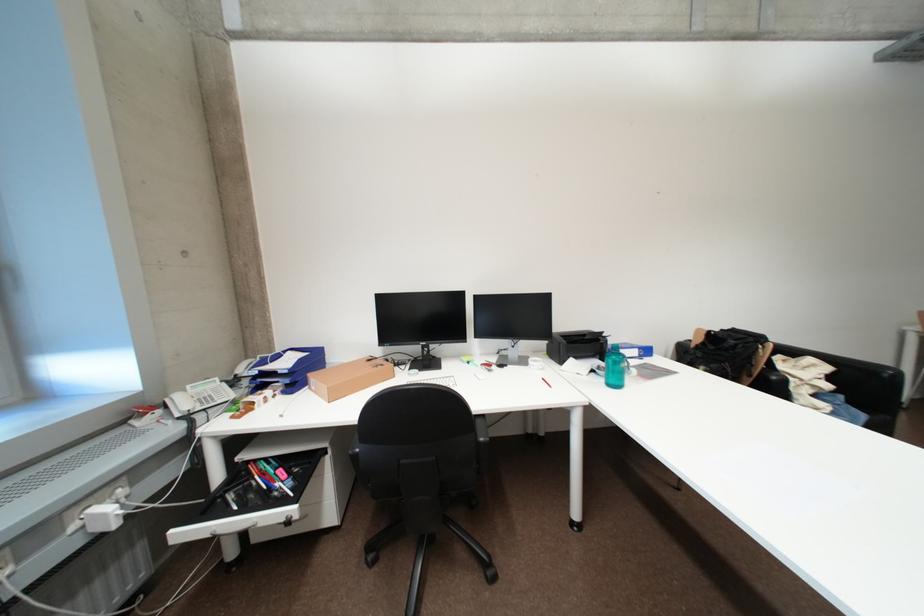
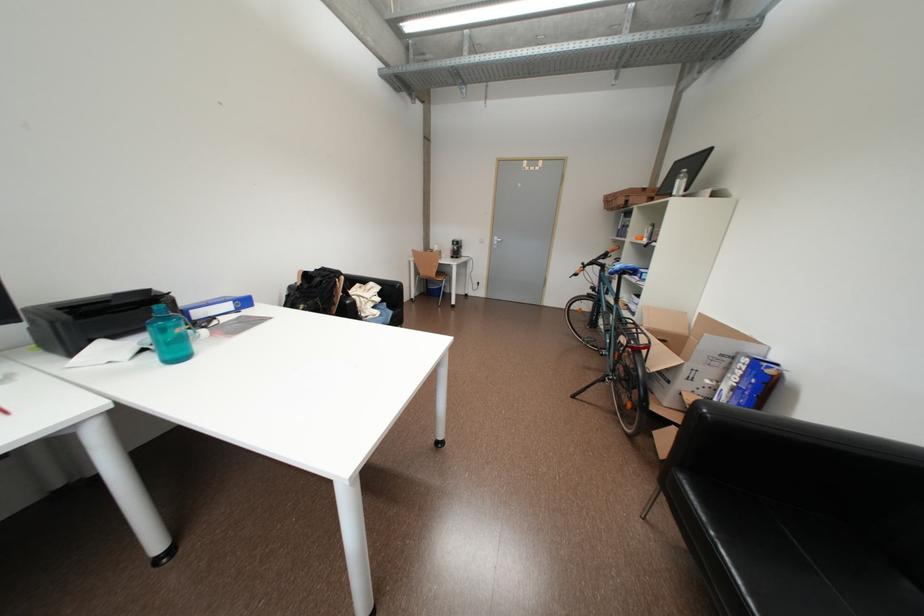
Where in the second image is the point corresponding to the point at 623,387 from the first image?

(186, 360)